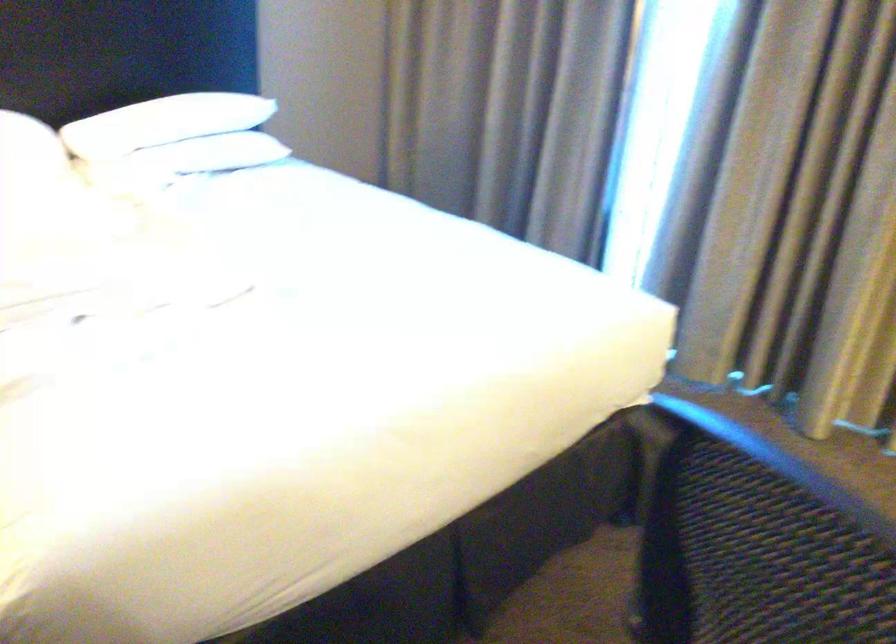
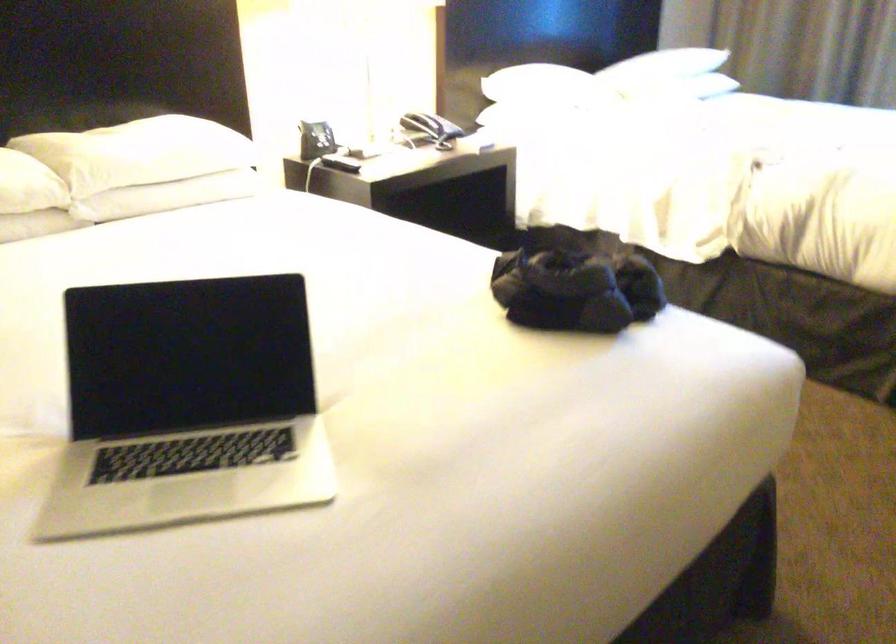
What movement of the cameraman would produce the second image?

The movement direction of the cameraman is left, backward.